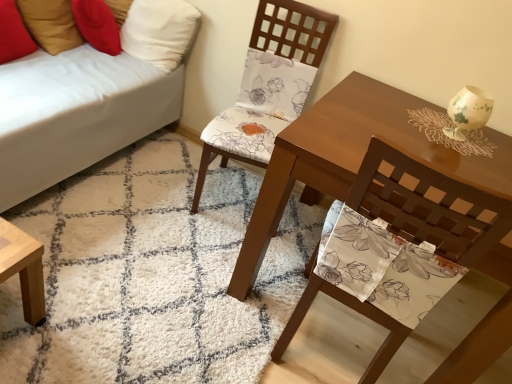
Question: Is white fabric couch at lower left to the left of red fabric pillow at upper left, the 1th pillow when ordered from left to right, from the viewer's perspective?

Choices:
 (A) no
 (B) yes

Answer: (A)

Question: Can you confirm if white fabric couch at lower left is wider than red fabric pillow at upper left, the 1th pillow when ordered from left to right?

Choices:
 (A) no
 (B) yes

Answer: (B)

Question: Would you say white fabric couch at lower left is outside red fabric pillow at upper left, the 1th pillow when ordered from left to right?

Choices:
 (A) yes
 (B) no

Answer: (A)

Question: From a real-world perspective, is white fabric couch at lower left physically below red fabric pillow at upper left, the 1th pillow when ordered from left to right?

Choices:
 (A) no
 (B) yes

Answer: (B)

Question: Does white fabric couch at lower left have a lesser width compared to red fabric pillow at upper left, the 1th pillow when ordered from left to right?

Choices:
 (A) no
 (B) yes

Answer: (A)

Question: From a real-world perspective, is white shaggy rug at center above or below matte floral fabric chair at center, marked as the 2th chair in a front-to-back arrangement?

Choices:
 (A) above
 (B) below

Answer: (B)

Question: Is white shaggy rug at center in front of or behind matte floral fabric chair at center, marked as the 2th chair in a front-to-back arrangement, in the image?

Choices:
 (A) behind
 (B) front

Answer: (B)

Question: From the image's perspective, is white shaggy rug at center positioned above or below matte floral fabric chair at center, marked as the 2th chair in a front-to-back arrangement?

Choices:
 (A) below
 (B) above

Answer: (A)

Question: Would you say white shaggy rug at center is to the left or to the right of matte floral fabric chair at center, positioned as the 1th chair in back-to-front order, in the picture?

Choices:
 (A) left
 (B) right

Answer: (A)

Question: From a real-world perspective, is red fabric pillow at upper left, the 1th pillow when ordered from left to right, positioned above or below matte brown table at center?

Choices:
 (A) above
 (B) below

Answer: (A)

Question: Based on their positions, is red fabric pillow at upper left, the second pillow viewed from the right, located to the left or right of matte brown table at center?

Choices:
 (A) left
 (B) right

Answer: (A)

Question: From their relative heights in the image, would you say red fabric pillow at upper left, the second pillow viewed from the right, is taller or shorter than matte brown table at center?

Choices:
 (A) tall
 (B) short

Answer: (B)

Question: Considering the positions of point (27, 51) and point (367, 125), is point (27, 51) closer or farther from the camera than point (367, 125)?

Choices:
 (A) closer
 (B) farther

Answer: (B)

Question: From the image's perspective, is white shaggy rug at center positioned above or below floral fabric chair at center, the 2th chair from the back?

Choices:
 (A) above
 (B) below

Answer: (B)

Question: Is white shaggy rug at center in front of or behind floral fabric chair at center, positioned as the first chair in front-to-back order, in the image?

Choices:
 (A) front
 (B) behind

Answer: (B)